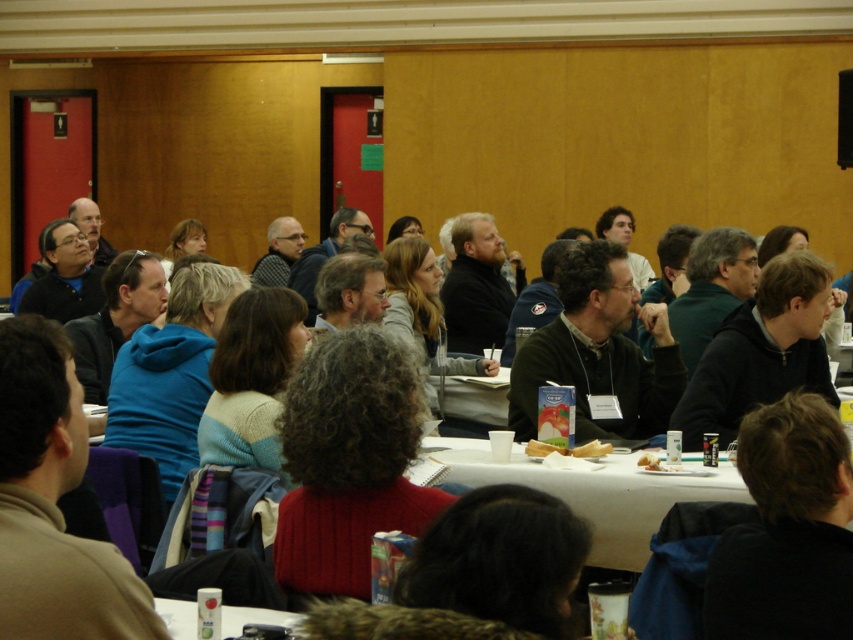
Where is `dark brown hair at lower right`? The image size is (853, 640). dark brown hair at lower right is located at coordinates (787, 529).

Find the location of `dark brown hair at lower right`. dark brown hair at lower right is located at coordinates (787, 529).

This screenshot has height=640, width=853. Identify the location of dark brown hair at lower right. (787, 529).

Can you confirm if dark green sweater at center is positioned below white paper plate at center?

No.

Which of these two, dark green sweater at center or white paper plate at center, stands shorter?

white paper plate at center is shorter.

Does point (624, 342) come behind point (537, 451)?

Yes, it is.

Where is `dark green sweater at center`? Image resolution: width=853 pixels, height=640 pixels. dark green sweater at center is located at coordinates (598, 353).

Is dark gray hoodie at center positioned at the back of white paper plate at lower center?

Yes, dark gray hoodie at center is further from the viewer.

Who is lower down, dark gray hoodie at center or white paper plate at lower center?

white paper plate at lower center is below.

Between point (802, 305) and point (595, 492), which one is positioned behind?

Positioned behind is point (802, 305).

The image size is (853, 640). I want to click on dark gray hoodie at center, so click(761, 352).